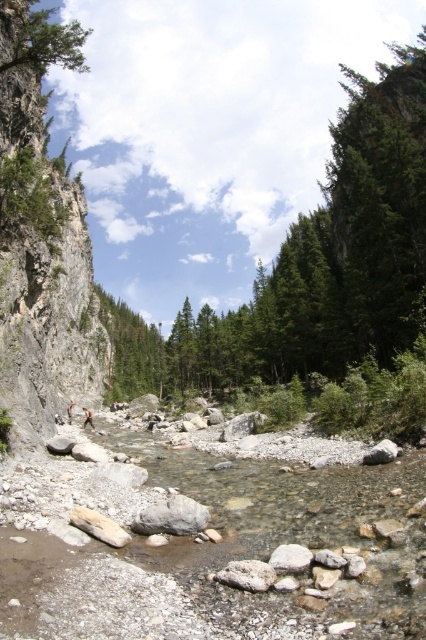
Can you confirm if rocky cliff at left is positioned below green matte tree at upper left?

Correct, rocky cliff at left is located below green matte tree at upper left.

Who is lower down, rocky cliff at left or green matte tree at upper left?

rocky cliff at left

Between point (85, 35) and point (60, 45), which one is positioned behind?

Positioned behind is point (85, 35).

Where is `rocky cliff at left`? rocky cliff at left is located at coordinates (42, 241).